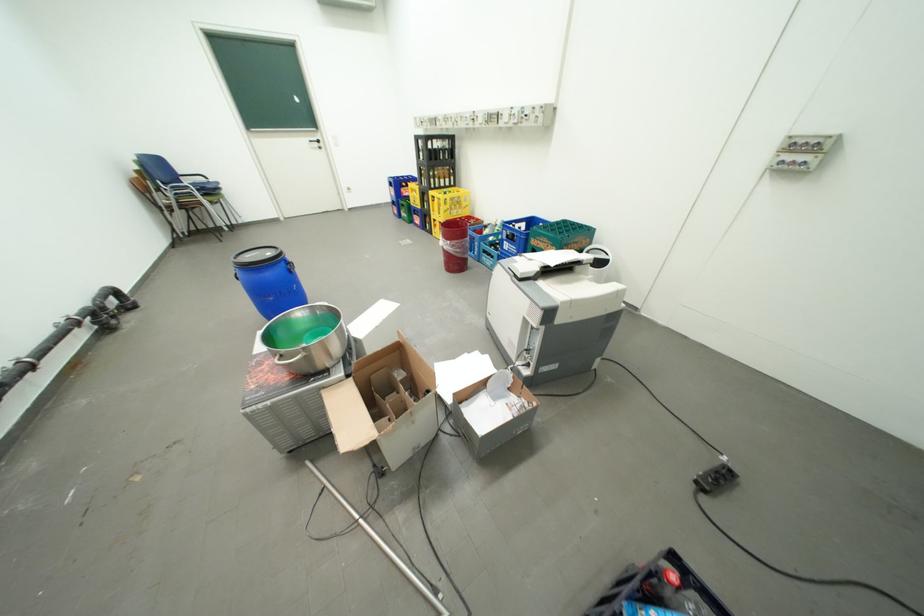
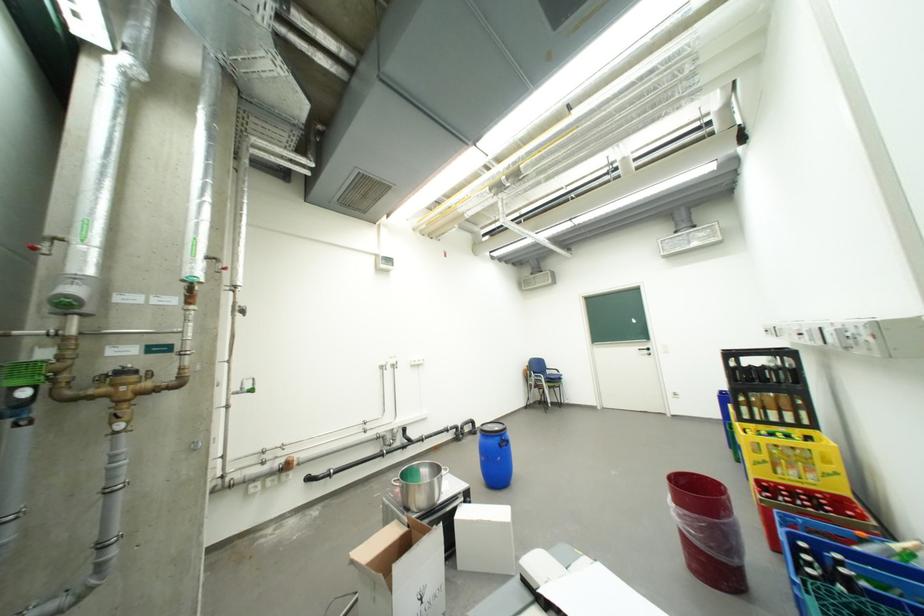
Where in the second image is the point corresponding to point 387,325 from the first image?

(484, 520)